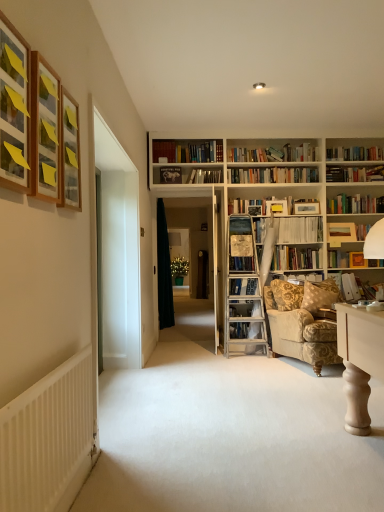
You are a GUI agent. You are given a task and a screenshot of the screen. Output one action in this format:
    pyautogui.click(x=<x>, y=<y>)
    Task: Click on the wooden picture frame at upper left, the third picture frame from the right
    This screenshot has height=512, width=384.
    Given the screenshot: What is the action you would take?
    pyautogui.click(x=44, y=130)

You are a GUI agent. You are given a task and a screenshot of the screen. Output one action in this format:
    pyautogui.click(x=<x>, y=<y>)
    Task: Click on the metallic silver picture frame at upper center, which appears as the first picture frame when viewed from the back
    The image size is (384, 512).
    Given the screenshot: What is the action you would take?
    pyautogui.click(x=170, y=175)

How much space does wooden book at upper right, which is counted as the third book, starting from the top, occupy vertically?

wooden book at upper right, which is counted as the third book, starting from the top, is 10.39 inches tall.

Image resolution: width=384 pixels, height=512 pixels. What are the coordinates of `wooden framed picture at upper left, which is the third picture frame from front to back` in the screenshot? It's located at (70, 153).

Find the location of `wooden picture frame at upper left, positioned as the second picture frame in left-to-right order`. wooden picture frame at upper left, positioned as the second picture frame in left-to-right order is located at coordinates (44, 130).

Which is more to the left, wooden picture frame at upper left, the third picture frame positioned from the back, or hardcover book at upper right, marked as the 1th book in a right-to-left arrangement?

wooden picture frame at upper left, the third picture frame positioned from the back, is more to the left.

From the hardcover book at upper right, which is the fourth book from top to bottom, count the 3rd picture frame to the left and point to it. Please provide its 2D coordinates.

[(44, 130)]

In terms of size, does wooden picture frame at upper left, the third picture frame positioned from the back, appear bigger or smaller than hardcover book at upper right, marked as the 1th book in a right-to-left arrangement?

Considering their sizes, wooden picture frame at upper left, the third picture frame positioned from the back, takes up less space than hardcover book at upper right, marked as the 1th book in a right-to-left arrangement.

In the scene shown: From a real-world perspective, which object rests below the other?

hardcover book at upper right, arranged as the fifth book when viewed from the left, from a real-world perspective.

Which object is thinner, hardcover book at upper right, acting as the 2th book starting from the bottom, or transparent glass door at center?

Thinner between the two is transparent glass door at center.

From the image's perspective, is hardcover book at upper right, acting as the 2th book starting from the bottom, above or below transparent glass door at center?

hardcover book at upper right, acting as the 2th book starting from the bottom, is situated lower than transparent glass door at center in the image.

Who is taller, hardcover book at upper right, marked as the 1th book in a right-to-left arrangement, or transparent glass door at center?

With more height is transparent glass door at center.

Is the depth of wooden picture frame at upper left, positioned as the second picture frame in left-to-right order, greater than that of metallic silver picture frame at upper center, which appears as the first picture frame when viewed from the back?

No, the depth of wooden picture frame at upper left, positioned as the second picture frame in left-to-right order, is less than that of metallic silver picture frame at upper center, which appears as the first picture frame when viewed from the back.

Is point (57, 147) positioned after point (165, 176)?

No, (57, 147) is in front of (165, 176).

Identify the location of the 2nd picture frame to the right of the wooden picture frame at upper left, the third picture frame from the right, counting from the anchor's position. Image resolution: width=384 pixels, height=512 pixels. (170, 175).

Which of these two, wooden picture frame at upper left, positioned as the second picture frame in left-to-right order, or metallic silver picture frame at upper center, arranged as the 4th picture frame when viewed from the front, is smaller?

With smaller size is metallic silver picture frame at upper center, arranged as the 4th picture frame when viewed from the front.

Is point (68, 161) in front of point (366, 274)?

Yes, it is in front of point (366, 274).

Is white paper book at center-right, marked as the fifth book in a top-to-bottom arrangement, completely or partially inside wooden framed picture at upper left, arranged as the 2th picture frame when viewed from the back?

No, white paper book at center-right, marked as the fifth book in a top-to-bottom arrangement, is not surrounded by wooden framed picture at upper left, arranged as the 2th picture frame when viewed from the back.

Identify the location of the 4th book below the wooden framed picture at upper left, the 3th picture frame in the left-to-right sequence (from a real-world perspective). (337, 276).

From a real-world perspective, is wooden framed picture at upper left, which is the third picture frame from front to back, over white paper book at center-right, which is counted as the first book, starting from the bottom?

Yes, from a real-world perspective, wooden framed picture at upper left, which is the third picture frame from front to back, is above white paper book at center-right, which is counted as the first book, starting from the bottom.

From the image's perspective, count 1st books downward from the metallic silver picture frame at upper center, which appears as the first picture frame when viewed from the back, and point to it. Please provide its 2D coordinates.

[(298, 229)]

Does white paper book at center, arranged as the second book when viewed from the top, have a larger size compared to metallic silver picture frame at upper center, positioned as the first picture frame in right-to-left order?

Yes, white paper book at center, arranged as the second book when viewed from the top, is bigger than metallic silver picture frame at upper center, positioned as the first picture frame in right-to-left order.

Is white paper book at center, which is counted as the 4th book, starting from the bottom, facing away from metallic silver picture frame at upper center, arranged as the 4th picture frame when viewed from the front?

No.

Which object is wider, white paper book at center, which is counted as the 4th book, starting from the bottom, or metallic silver picture frame at upper center, positioned as the first picture frame in right-to-left order?

Wider between the two is white paper book at center, which is counted as the 4th book, starting from the bottom.

Are white paper book at center-right, marked as the fifth book in a top-to-bottom arrangement, and wooden picture frame at upper left, the third picture frame positioned from the back, far apart?

Yes, white paper book at center-right, marked as the fifth book in a top-to-bottom arrangement, and wooden picture frame at upper left, the third picture frame positioned from the back, are located far from each other.

Measure the distance from white paper book at center-right, marked as the second book in a right-to-left arrangement, to wooden picture frame at upper left, the third picture frame from the right.

white paper book at center-right, marked as the second book in a right-to-left arrangement, is 4.12 meters from wooden picture frame at upper left, the third picture frame from the right.

Is white paper book at center-right, which ranks as the fourth book in left-to-right order, wider or thinner than wooden picture frame at upper left, acting as the second picture frame starting from the front?

In the image, white paper book at center-right, which ranks as the fourth book in left-to-right order, appears to be wider than wooden picture frame at upper left, acting as the second picture frame starting from the front.

Would you say white paper book at center-right, marked as the second book in a right-to-left arrangement, is inside or outside wooden picture frame at upper left, positioned as the second picture frame in left-to-right order?

white paper book at center-right, marked as the second book in a right-to-left arrangement, is outside wooden picture frame at upper left, positioned as the second picture frame in left-to-right order.

Looking at their sizes, would you say wooden book at upper right, which is the 3th book from left to right, is wider or thinner than white paper book at center, the fourth book viewed from the right?

wooden book at upper right, which is the 3th book from left to right, is thinner than white paper book at center, the fourth book viewed from the right.

Could you measure the distance between wooden book at upper right, the third book when ordered from right to left, and white paper book at center, arranged as the second book when viewed from the top?

wooden book at upper right, the third book when ordered from right to left, is 18.61 inches away from white paper book at center, arranged as the second book when viewed from the top.

You are a GUI agent. You are given a task and a screenshot of the screen. Output one action in this format:
    pyautogui.click(x=<x>, y=<y>)
    Task: Click on the 1st book below the white paper book at center, the fourth book viewed from the right (from a real-world perspective)
    
    Given the screenshot: What is the action you would take?
    pyautogui.click(x=346, y=232)

Is point (353, 237) less distant than point (280, 240)?

No.

Locate an element on the screen. The width and height of the screenshot is (384, 512). the 3rd book behind when counting from the wooden picture frame at upper left, positioned as the second picture frame in left-to-right order is located at coordinates (370, 290).

This screenshot has height=512, width=384. Find the location of `glass door above the hardcover book at upper right, marked as the 1th book in a right-to-left arrangement (from a real-world perspective)`. glass door above the hardcover book at upper right, marked as the 1th book in a right-to-left arrangement (from a real-world perspective) is located at coordinates [196, 237].

Based on their spatial positions, is wooden book at upper right, the third book when ordered from right to left, or wooden framed picture at upper left, arranged as the 2th picture frame when viewed from the back, further from hardcover book at upper center, the 5th book ordered from the bottom?

Based on the image, wooden framed picture at upper left, arranged as the 2th picture frame when viewed from the back, appears to be further to hardcover book at upper center, the 5th book ordered from the bottom.

Considering their positions, is transparent glass door at center positioned closer to wooden framed picture at upper left, the 3th picture frame in the left-to-right sequence, than hardcover book at upper right, arranged as the fifth book when viewed from the left?

Among the two, hardcover book at upper right, arranged as the fifth book when viewed from the left, is located nearer to wooden framed picture at upper left, the 3th picture frame in the left-to-right sequence.

From the image, which object appears to be farther from white paper book at center, positioned as the 2th book in left-to-right order, gold-patterned fabric armchair at lower right or black fabric curtain at center?

Based on the image, black fabric curtain at center appears to be further to white paper book at center, positioned as the 2th book in left-to-right order.

Looking at the image, which one is located further to hardcover book at upper center, which is counted as the first book, starting from the left, hardcover book at upper right, arranged as the fifth book when viewed from the left, or white ribbed radiator at lower left?

white ribbed radiator at lower left is further to hardcover book at upper center, which is counted as the first book, starting from the left.

From the image, which object appears to be farther from white paper book at center-right, marked as the second book in a right-to-left arrangement, white paper book at center, arranged as the second book when viewed from the top, or hardcover book at upper center, the 5th book ordered from the bottom?

The object further to white paper book at center-right, marked as the second book in a right-to-left arrangement, is hardcover book at upper center, the 5th book ordered from the bottom.

When comparing their distances from wooden picture frame at upper left, the third picture frame positioned from the back, does hardcover book at upper center, the 1th book from the top, or white ribbed radiator at lower left seem closer?

Among the two, white ribbed radiator at lower left is located nearer to wooden picture frame at upper left, the third picture frame positioned from the back.

Which object lies nearer to the anchor point metallic silver picture frame at upper center, arranged as the 4th picture frame when viewed from the front, transparent glass door at center or white paper book at center, arranged as the second book when viewed from the top?

Among the two, white paper book at center, arranged as the second book when viewed from the top, is located nearer to metallic silver picture frame at upper center, arranged as the 4th picture frame when viewed from the front.

Which object lies nearer to the anchor point transparent glass door at center, wooden picture frame at upper left, the third picture frame positioned from the back, or metallic silver picture frame at upper center, positioned as the first picture frame in right-to-left order?

metallic silver picture frame at upper center, positioned as the first picture frame in right-to-left order, is positioned closer to the anchor transparent glass door at center.

Find the location of a particular element. chair between metallic silver picture frame at upper center, arranged as the 4th picture frame when viewed from the front, and hardcover book at upper right, arranged as the fifth book when viewed from the left is located at coordinates (306, 330).

Find the location of a particular element. The image size is (384, 512). chair between wooden picture frame at upper left, the third picture frame positioned from the back, and hardcover book at upper right, acting as the 2th book starting from the bottom, from front to back is located at coordinates (306, 330).

Find the location of `chair between wooden picture frame at upper left, which is the first picture frame from front to back, and black fabric curtain at center from front to back`. chair between wooden picture frame at upper left, which is the first picture frame from front to back, and black fabric curtain at center from front to back is located at coordinates (306, 330).

Locate an element on the screen. The height and width of the screenshot is (512, 384). glass door between black fabric curtain at center and white paper book at center, which is counted as the 4th book, starting from the bottom, in the horizontal direction is located at coordinates (196, 237).